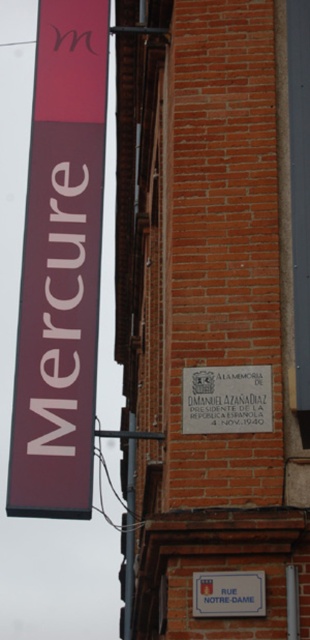
What is the location of the point with coordinates (61,266) in the image?

The point with coordinates (61,266) is located on the matte maroon sign at left.

What is the relationship between the sizes of the matte maroon sign at left and the maroon matte sign at left in the image?

The matte maroon sign at left is larger in size compared to the maroon matte sign at left.

You are a tour guide explaining the historical plaques in the area. You have two plaques here, the matte white plaque at center and the white plastic sign at lower center. Which one is bigger?

The matte white plaque at center is larger in size than the white plastic sign at lower center.